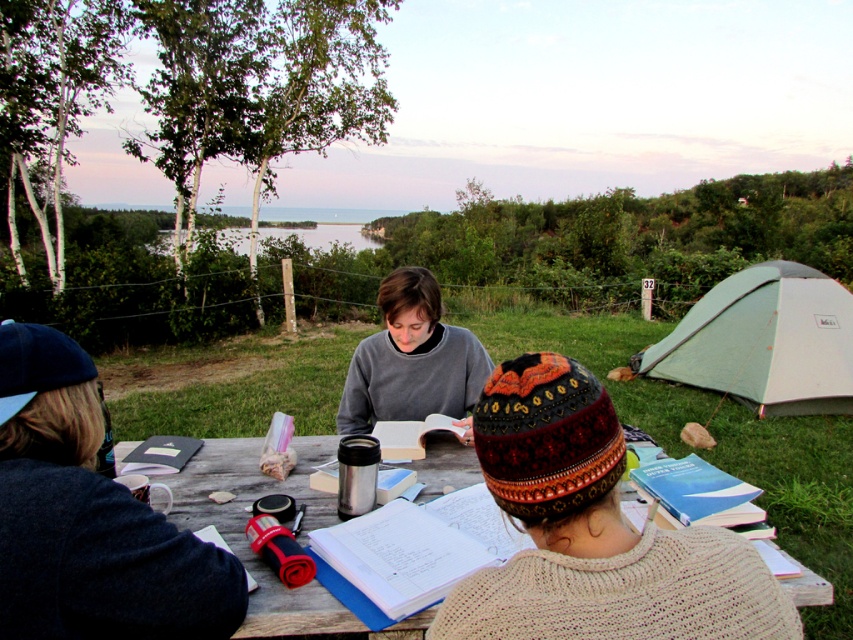
Question: Among these points, which one is farthest from the camera?

Choices:
 (A) (792, 380)
 (B) (425, 364)
 (C) (189, 497)
 (D) (561, 358)

Answer: (A)

Question: Which object is farther from the camera taking this photo?

Choices:
 (A) gray sweater at center
 (B) knitted woolen hat at lower right
 (C) wooden table at center
 (D) white fabric tent at right

Answer: (D)

Question: Which point appears closest to the camera in this image?

Choices:
 (A) (785, 381)
 (B) (361, 403)
 (C) (721, 547)
 (D) (283, 484)

Answer: (C)

Question: Is white fabric tent at right closer to camera compared to wooden table at center?

Choices:
 (A) yes
 (B) no

Answer: (B)

Question: Does knitted woolen hat at lower right come in front of wooden table at center?

Choices:
 (A) no
 (B) yes

Answer: (B)

Question: Can you confirm if knitted woolen hat at lower right is thinner than wooden table at center?

Choices:
 (A) no
 (B) yes

Answer: (B)